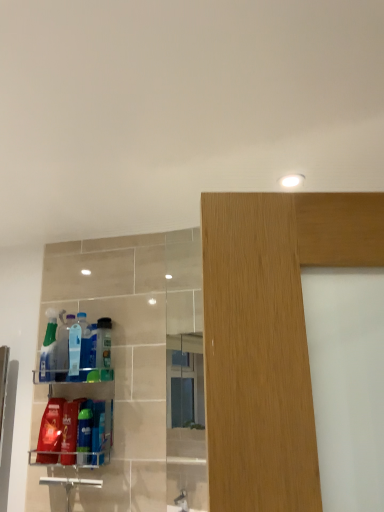
Question: Considering the positions of matte red plastic bottle at lower left, acting as the second cleaning product starting from the left, and translucent plastic bottles at left, marked as the 4th cleaning product in a left-to-right arrangement, in the image, is matte red plastic bottle at lower left, acting as the second cleaning product starting from the left, bigger or smaller than translucent plastic bottles at left, marked as the 4th cleaning product in a left-to-right arrangement,?

Choices:
 (A) small
 (B) big

Answer: (B)

Question: From a real-world perspective, relative to translucent plastic bottles at left, arranged as the 5th cleaning product when viewed from the right, is matte red plastic bottle at lower left, acting as the second cleaning product starting from the left, vertically above or below?

Choices:
 (A) below
 (B) above

Answer: (A)

Question: Considering the real-world distances, which object is farthest from the translucent plastic bottle at left, the 3th cleaning product when ordered from left to right?

Choices:
 (A) blue glossy bottle at lower left, the 6th cleaning product in the left-to-right sequence
 (B) translucent plastic bottle at center, the 8th cleaning product when ordered from left to right
 (C) matte red plastic bottle at lower left, acting as the 7th cleaning product starting from the right
 (D) translucent plastic bottles at left
 (E) translucent plastic spray bottle at left, marked as the eighth cleaning product in a right-to-left arrangement

Answer: (A)

Question: Estimate the real-world distances between objects in this image. Which object is closer to the matte red plastic bottle at lower left, acting as the second cleaning product starting from the left?

Choices:
 (A) translucent plastic bottles at left
 (B) translucent plastic bottle at center, acting as the 1th cleaning product starting from the right
 (C) translucent plastic spray bottle at left, marked as the eighth cleaning product in a right-to-left arrangement
 (D) blue glossy bottle at lower left, which appears as the 3th cleaning product when viewed from the right
 (E) translucent plastic bottle at left, the 6th cleaning product from the right

Answer: (A)